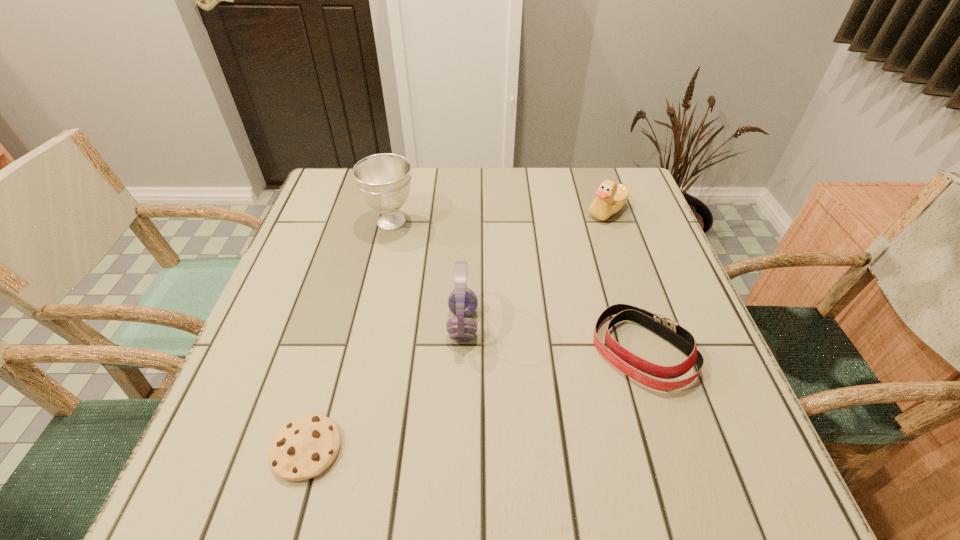
Find the location of a particular element. Image resolution: width=960 pixels, height=540 pixels. object present at the far left corner is located at coordinates (384, 180).

Find the location of a particular element. The width and height of the screenshot is (960, 540). object positioned at the near left corner is located at coordinates (305, 447).

Identify the location of object present at the far right corner. This screenshot has width=960, height=540. (611, 197).

Where is `free space at the far edge of the desktop`? Image resolution: width=960 pixels, height=540 pixels. free space at the far edge of the desktop is located at coordinates (500, 197).

The width and height of the screenshot is (960, 540). In the image, there is a desktop. In order to click on free space at the left edge in this screenshot , I will do `click(293, 296)`.

This screenshot has width=960, height=540. What are the coordinates of `vacant space at the right edge of the desktop` in the screenshot? It's located at (626, 342).

The height and width of the screenshot is (540, 960). I want to click on vacant space at the far left corner of the desktop, so click(x=366, y=207).

In the image, there is a desktop. Where is `vacant space at the near right corner`? The image size is (960, 540). vacant space at the near right corner is located at coordinates (747, 455).

Where is `empty space between the chalice and the third shortest object`? The height and width of the screenshot is (540, 960). empty space between the chalice and the third shortest object is located at coordinates (499, 217).

Locate an element on the screen. free space between the second shortest object and the chalice is located at coordinates pyautogui.click(x=516, y=286).